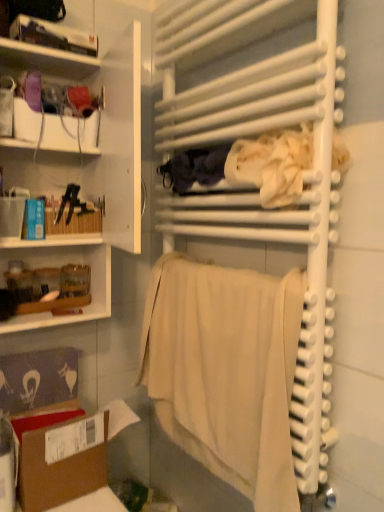
Question: Is white fabric at center, positioned as the first clothing in right-to-left order, taller than white matte cabinet at left, placed as the second shelf when sorted from top to bottom?

Choices:
 (A) yes
 (B) no

Answer: (B)

Question: Are white fabric at center, positioned as the first clothing in right-to-left order, and white matte cabinet at left, placed as the 1th shelf when sorted from bottom to top, far apart?

Choices:
 (A) no
 (B) yes

Answer: (A)

Question: Considering the relative positions of white fabric at center, which ranks as the 2th clothing in left-to-right order, and white matte cabinet at left, placed as the second shelf when sorted from top to bottom, in the image provided, is white fabric at center, which ranks as the 2th clothing in left-to-right order, to the left of white matte cabinet at left, placed as the second shelf when sorted from top to bottom, from the viewer's perspective?

Choices:
 (A) yes
 (B) no

Answer: (B)

Question: Can you confirm if white fabric at center, which ranks as the 2th clothing in left-to-right order, is wider than white matte cabinet at left, placed as the 1th shelf when sorted from bottom to top?

Choices:
 (A) no
 (B) yes

Answer: (A)

Question: Does white fabric at center, which ranks as the 2th clothing in left-to-right order, turn towards white matte cabinet at left, placed as the 1th shelf when sorted from bottom to top?

Choices:
 (A) yes
 (B) no

Answer: (B)

Question: Is white fabric at center, which ranks as the 2th clothing in left-to-right order, closer to the viewer compared to white matte cabinet at left, placed as the second shelf when sorted from top to bottom?

Choices:
 (A) yes
 (B) no

Answer: (B)

Question: Does brown cardboard box at lower left come in front of white glossy bookshelf at upper left, the first shelf from the top?

Choices:
 (A) yes
 (B) no

Answer: (A)

Question: Does brown cardboard box at lower left have a smaller size compared to white glossy bookshelf at upper left, which ranks as the second shelf in bottom-to-top order?

Choices:
 (A) no
 (B) yes

Answer: (A)

Question: Is the position of brown cardboard box at lower left more distant than that of white glossy bookshelf at upper left, which ranks as the second shelf in bottom-to-top order?

Choices:
 (A) yes
 (B) no

Answer: (B)

Question: Is brown cardboard box at lower left to the left of white glossy bookshelf at upper left, the first shelf from the top, from the viewer's perspective?

Choices:
 (A) no
 (B) yes

Answer: (A)

Question: Can you confirm if brown cardboard box at lower left is taller than white glossy bookshelf at upper left, which ranks as the second shelf in bottom-to-top order?

Choices:
 (A) no
 (B) yes

Answer: (B)

Question: From the image's perspective, does brown cardboard box at lower left appear lower than white glossy bookshelf at upper left, which ranks as the second shelf in bottom-to-top order?

Choices:
 (A) no
 (B) yes

Answer: (B)

Question: Does white matte cabinet at left, placed as the second shelf when sorted from top to bottom, appear on the right side of white fabric at center, which ranks as the 2th clothing in left-to-right order?

Choices:
 (A) yes
 (B) no

Answer: (B)